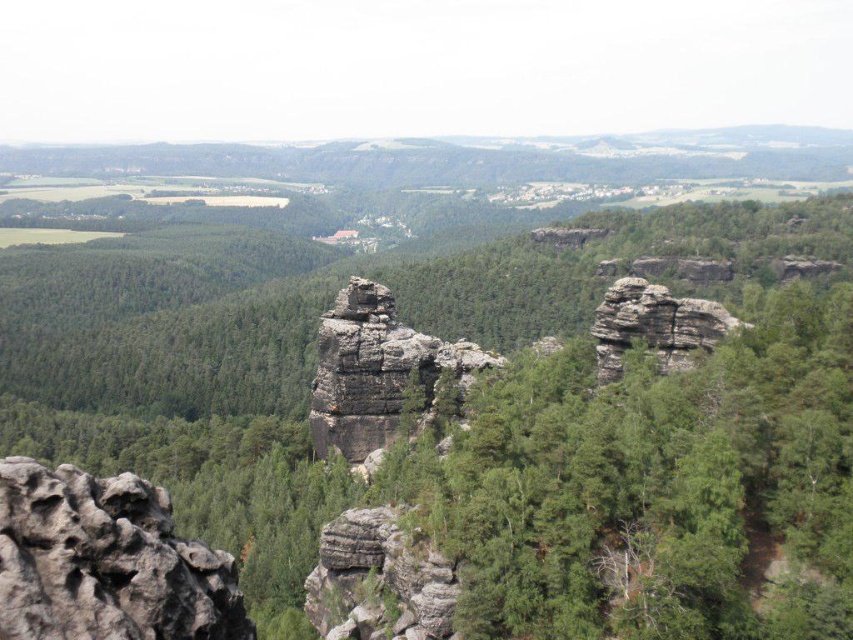
You are a geologist examining the landscape. You notice two rocks in the image. The first is the green rough rock at center, and the second is the rugged stone rock formation at center. Which of these two rocks is bigger?

The green rough rock at center is larger in size compared to the rugged stone rock formation at center.

You are a geologist examining the landscape. You notice the green rough rock at center and the rugged stone rock formation at center. Based on their positions, which one do you think is higher in elevation?

The green rough rock at center is located above the rugged stone rock formation at center, so it has a higher elevation.

You are a hiker standing at the base of the green rough rock at center. You want to reach the summit of the rock. The trail is steep and rocky, and your average climbing speed is 1.5 meters per minute. How long will it take you to reach the top?

The green rough rock at center is 67.79 meters away from the viewer. Assuming the distance to the summit is approximately the same as the distance from the viewer, it would take roughly 67.79 meters divided by 1.5 meters per minute, which equals approximately 45.19 minutes. Therefore, it would take about 45 minutes to reach the summit.